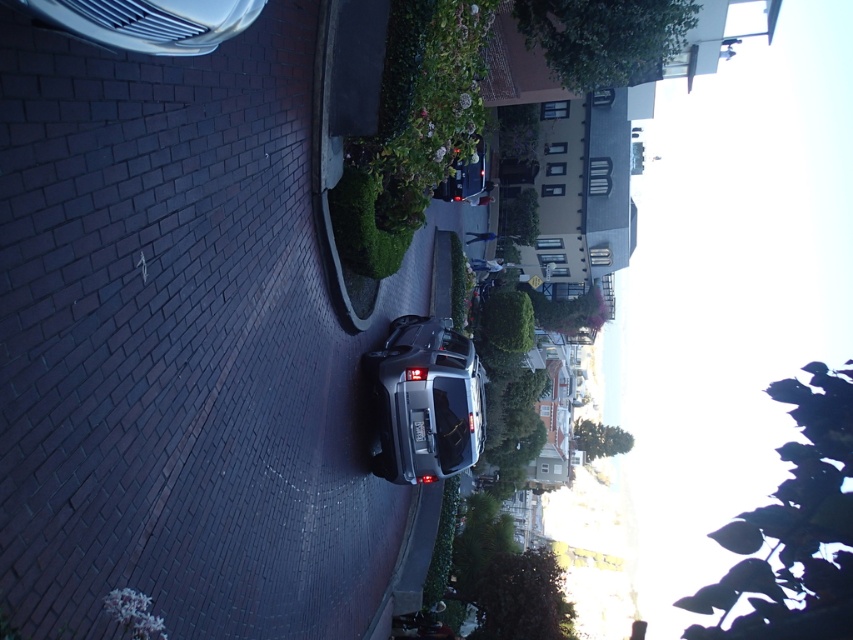
Is satin black suv at center further to the viewer compared to silver metallic car at upper left?

Yes.

Is satin black suv at center shorter than silver metallic car at upper left?

No, satin black suv at center is not shorter than silver metallic car at upper left.

The image size is (853, 640). Describe the element at coordinates (425, 401) in the screenshot. I see `satin black suv at center` at that location.

Locate an element on the screen. Image resolution: width=853 pixels, height=640 pixels. satin black suv at center is located at coordinates (425, 401).